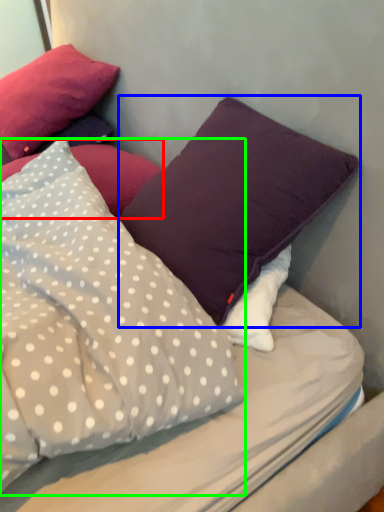
Question: Considering the real-world distances, which object is farthest from pillow (highlighted by a red box)? pillow (highlighted by a blue box) or pillow (highlighted by a green box)?

Choices:
 (A) pillow
 (B) pillow

Answer: (B)